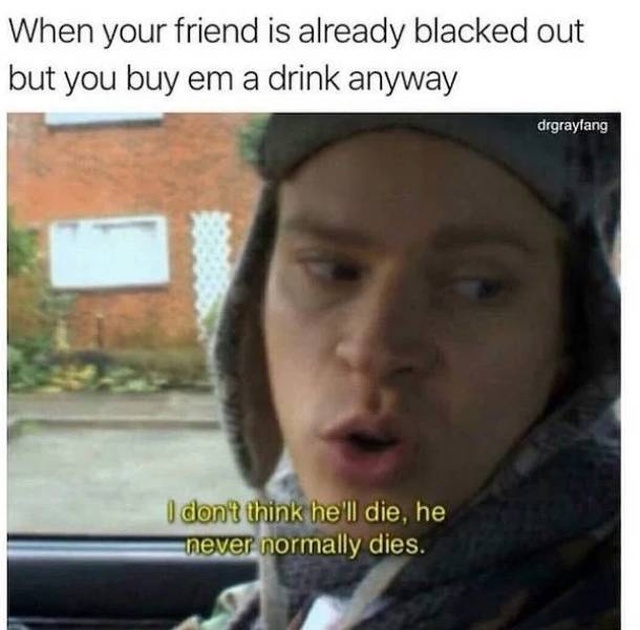
This screenshot has width=640, height=630. What are the coordinates of `window` in the screenshot? It's located at (102, 261).